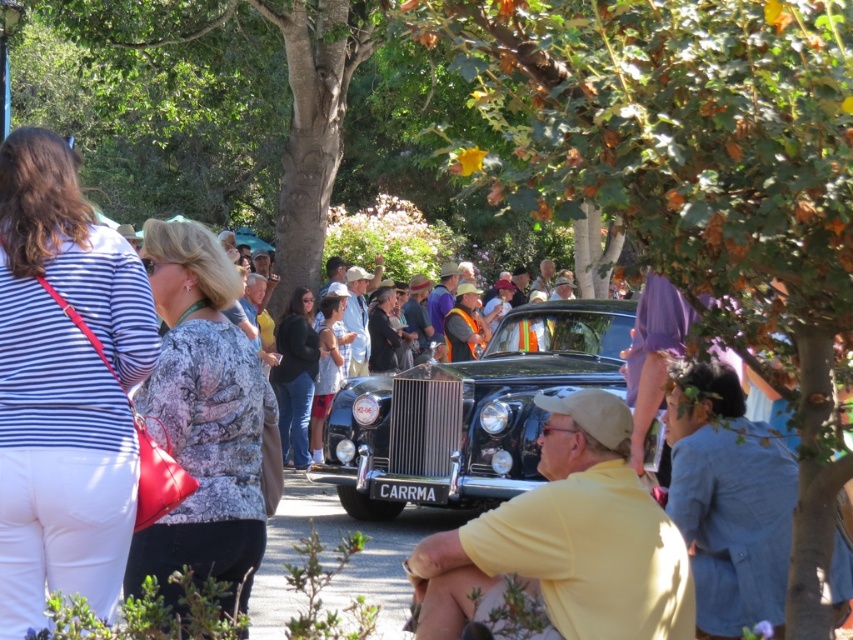
You are a photographer trying to capture a clear shot of the vintage black car. You notice the green leafy tree at upper center and the yellow cotton shirt at center might block your view. Can you determine if there is enough space between them to frame the car without obstruction?

The green leafy tree at upper center and yellow cotton shirt at center are 4.09 feet apart from each other. This distance should provide sufficient space to frame the vintage black car without obstruction, as 4.09 feet is a reasonable gap for positioning the camera between them.

Based on the photo, you are a photographer at the car show and want to capture both the striped fabric shirt at left and the yellow cotton shirt at center in a single shot. Which shirt should you focus on first to ensure both are in frame?

The striped fabric shirt at left is located above the yellow cotton shirt at center, so you should focus on the striped fabric shirt at left first to ensure both are in frame.